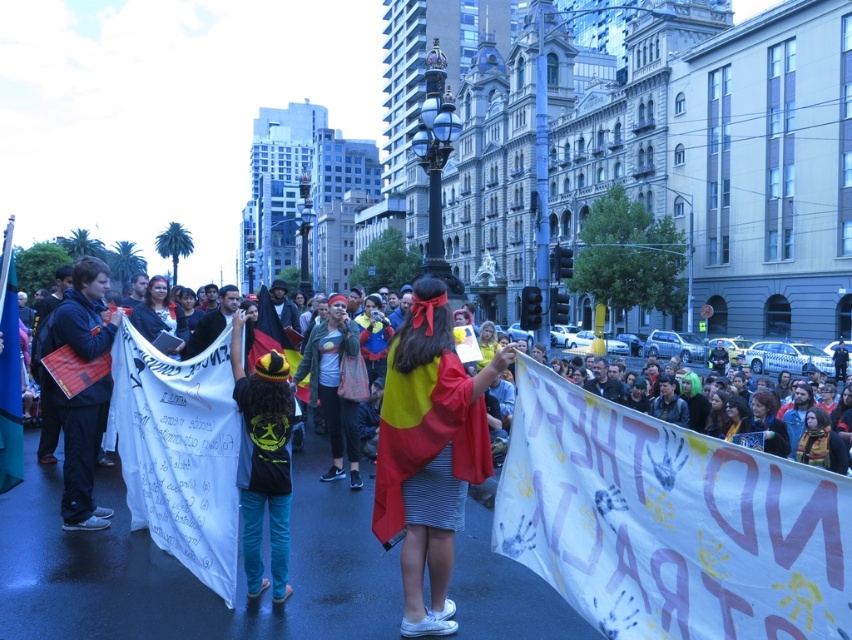
Question: Can you confirm if red/yellow fabric at center is positioned below denim jacket at center?

Choices:
 (A) no
 (B) yes

Answer: (B)

Question: Which object is the farthest from the red/yellow fabric at center?

Choices:
 (A) dark blue jacket at left
 (B) denim jacket at center
 (C) black matte t-shirt at center

Answer: (A)

Question: Is black matte t-shirt at center positioned behind dark blue jacket at left?

Choices:
 (A) no
 (B) yes

Answer: (A)

Question: Which object is positioned closest to the dark blue jacket at left?

Choices:
 (A) denim jacket at center
 (B) black matte t-shirt at center

Answer: (B)

Question: Can you confirm if black matte t-shirt at center is positioned above dark blue jacket at left?

Choices:
 (A) yes
 (B) no

Answer: (B)

Question: Which object is closer to the camera taking this photo?

Choices:
 (A) denim jacket at center
 (B) dark blue jacket at left
 (C) red/yellow fabric at center

Answer: (C)